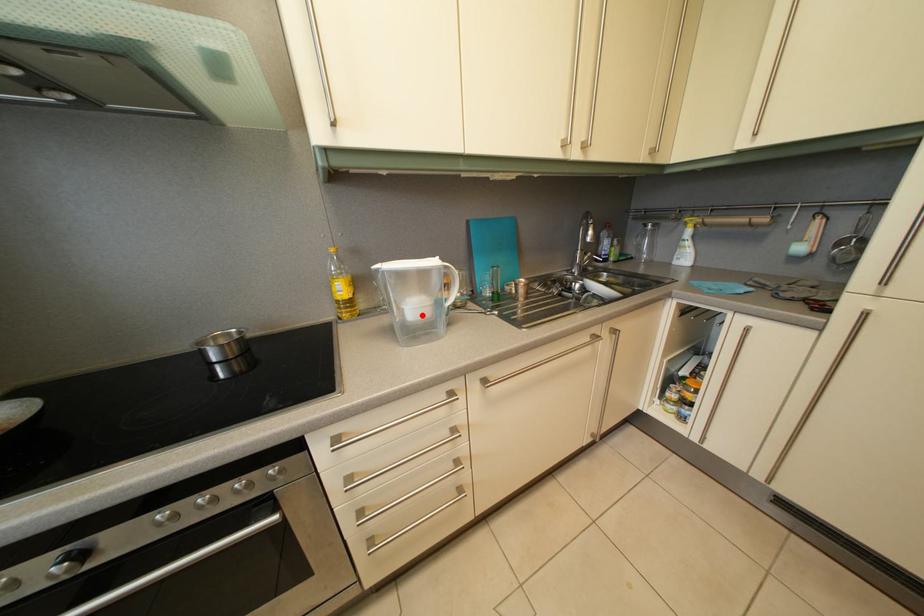
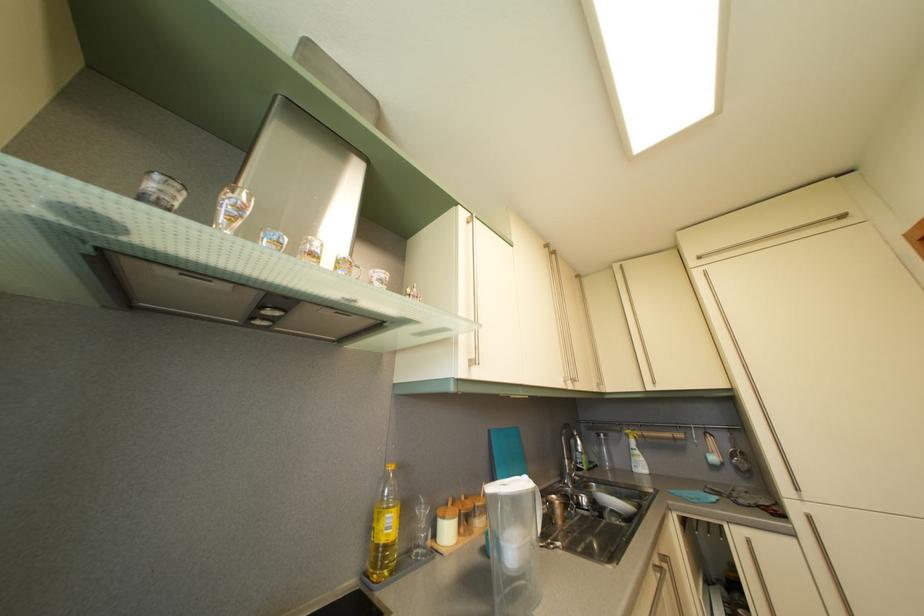
Question: I am providing you with two images of the same scene from different viewpoints. Given a red point in image1, look at the same physical point in image2. Is it:

Choices:
 (A) Closer to the viewpoint
 (B) Farther from the viewpoint

Answer: (B)